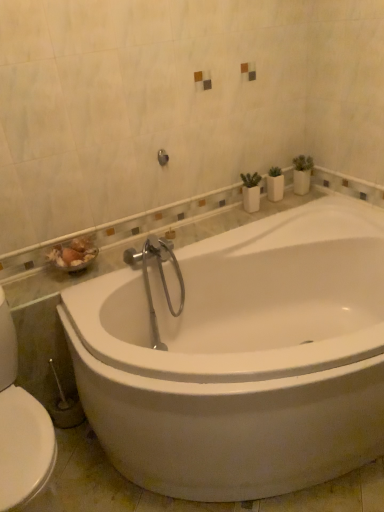
This screenshot has height=512, width=384. In order to click on brushed metal shower at upper center in this screenshot , I will do `click(163, 157)`.

The image size is (384, 512). Describe the element at coordinates (163, 157) in the screenshot. I see `brushed metal shower at upper center` at that location.

Describe the element at coordinates (242, 358) in the screenshot. I see `white glossy bathtub at center` at that location.

In order to face white glossy bathtub at center, should I rotate leftwards or rightwards?

Rotate your view right by about 11.506°.

Where is `white glossy bathtub at center`? This screenshot has width=384, height=512. white glossy bathtub at center is located at coordinates (242, 358).

Identify the location of brushed metal shower at upper center. (163, 157).

Is brushed metal shower at upper center at the left side of white glossy bathtub at center?

Yes.

Is brushed metal shower at upper center in front of or behind white glossy bathtub at center in the image?

Visually, brushed metal shower at upper center is located behind white glossy bathtub at center.

Which is nearer, (164, 159) or (269, 331)?

Point (164, 159) appears to be closer to the viewer than point (269, 331).

From the image's perspective, does brushed metal shower at upper center appear lower than white glossy bathtub at center?

No.

Looking at this image, from a real-world perspective, is brushed metal shower at upper center beneath white glossy bathtub at center?

Incorrect, from a real-world perspective, brushed metal shower at upper center is higher than white glossy bathtub at center.

Which of these two, brushed metal shower at upper center or white glossy bathtub at center, is wider?

white glossy bathtub at center.

Is brushed metal shower at upper center shorter than white glossy bathtub at center?

Yes.

Which of these two, brushed metal shower at upper center or white glossy bathtub at center, is bigger?

white glossy bathtub at center.

Is brushed metal shower at upper center situated inside white glossy bathtub at center or outside?

brushed metal shower at upper center is spatially situated outside white glossy bathtub at center.

Is brushed metal shower at upper center not close to white glossy bathtub at center?

They are positioned close to each other.

Does brushed metal shower at upper center turn towards white glossy bathtub at center?

No.

What's the angular difference between brushed metal shower at upper center and white glossy bathtub at center's facing directions?

0.00108 degrees separate the facing orientations of brushed metal shower at upper center and white glossy bathtub at center.

At what (x,y) coordinates should I click in order to perform the action: click on bathtub that is under the brushed metal shower at upper center (from a real-world perspective). Please return your answer as a coordinate pair (x, y). The image size is (384, 512). Looking at the image, I should click on (242, 358).

Visually, is white glossy bathtub at center positioned to the left or to the right of brushed metal shower at upper center?

white glossy bathtub at center is positioned on brushed metal shower at upper center's right side.

Considering the positions of objects white glossy bathtub at center and brushed metal shower at upper center in the image provided, who is behind, white glossy bathtub at center or brushed metal shower at upper center?

brushed metal shower at upper center.

Is point (298, 209) closer or farther from the camera than point (167, 154)?

Clearly, point (298, 209) is more distant from the camera than point (167, 154).

From the image's perspective, does white glossy bathtub at center appear lower than brushed metal shower at upper center?

Yes, from the image's perspective, white glossy bathtub at center is below brushed metal shower at upper center.

From a real-world perspective, between white glossy bathtub at center and brushed metal shower at upper center, who is vertically higher?

From a 3D spatial view, brushed metal shower at upper center is above.

Between white glossy bathtub at center and brushed metal shower at upper center, which one has smaller width?

With smaller width is brushed metal shower at upper center.

Which of these two, white glossy bathtub at center or brushed metal shower at upper center, stands taller?

With more height is white glossy bathtub at center.

From the picture: Which of these two, white glossy bathtub at center or brushed metal shower at upper center, is smaller?

brushed metal shower at upper center is smaller.

From the picture: Is brushed metal shower at upper center completely or partially inside white glossy bathtub at center?

Actually, brushed metal shower at upper center is outside white glossy bathtub at center.

Is white glossy bathtub at center next to brushed metal shower at upper center?

They are not placed beside each other.

Is white glossy bathtub at center positioned with its back to brushed metal shower at upper center?

No.

Can you tell me how much white glossy bathtub at center and brushed metal shower at upper center differ in facing direction?

0.00108 degrees.

The width and height of the screenshot is (384, 512). I want to click on bathtub below the brushed metal shower at upper center (from the image's perspective), so click(x=242, y=358).

Find the location of a particular element. This screenshot has width=384, height=512. shower located above the white glossy bathtub at center (from a real-world perspective) is located at coordinates (163, 157).

This screenshot has width=384, height=512. In order to click on bathtub that is under the brushed metal shower at upper center (from a real-world perspective) in this screenshot , I will do `click(242, 358)`.